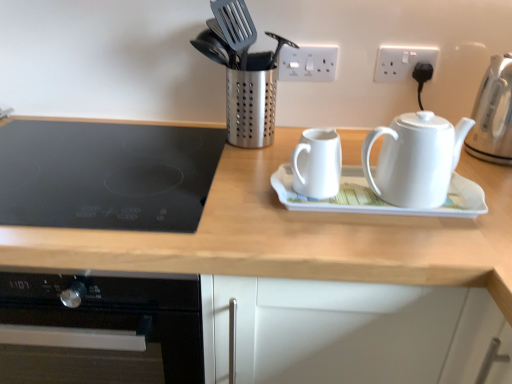
Where is `free spot in front of white glossy teapot at center, arranged as the first kettle when viewed from the left`? free spot in front of white glossy teapot at center, arranged as the first kettle when viewed from the left is located at coordinates (327, 235).